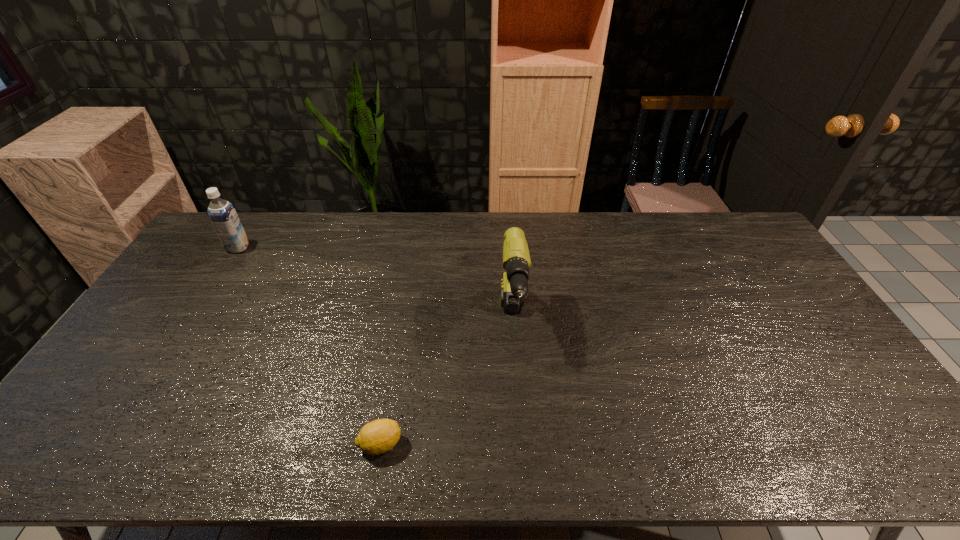
Locate an element on the screen. This screenshot has height=540, width=960. free space that is in between the leftmost object and the drill is located at coordinates (375, 284).

The height and width of the screenshot is (540, 960). Find the location of `free area in between the soya milk and the second nearest object`. free area in between the soya milk and the second nearest object is located at coordinates (375, 284).

Find the location of a particular element. unoccupied position between the soya milk and the second nearest object is located at coordinates (375, 284).

Locate an element on the screen. Image resolution: width=960 pixels, height=540 pixels. free space that is in between the drill and the shortest object is located at coordinates (446, 382).

You are a GUI agent. You are given a task and a screenshot of the screen. Output one action in this format:
    pyautogui.click(x=<x>, y=<y>)
    Task: Click on the vacant point located between the leftmost object and the second nearest object
    This screenshot has width=960, height=540.
    Given the screenshot: What is the action you would take?
    pyautogui.click(x=375, y=284)

At what (x,y) coordinates should I click in order to perform the action: click on free space that is in between the soya milk and the rightmost object. Please return your answer as a coordinate pair (x, y). The width and height of the screenshot is (960, 540). Looking at the image, I should click on (375, 284).

This screenshot has height=540, width=960. I want to click on vacant area that lies between the rightmost object and the leftmost object, so click(x=375, y=284).

At what (x,y) coordinates should I click in order to perform the action: click on empty space that is in between the nearest object and the rightmost object. Please return your answer as a coordinate pair (x, y). Image resolution: width=960 pixels, height=540 pixels. Looking at the image, I should click on (446, 382).

Locate an element on the screen. This screenshot has width=960, height=540. vacant space in between the shortest object and the soya milk is located at coordinates (309, 346).

Select which object appears as the second closest to the drill. Please provide its 2D coordinates. Your answer should be formatted as a tuple, i.e. [(x, y)], where the tuple contains the x and y coordinates of a point satisfying the conditions above.

[(222, 214)]